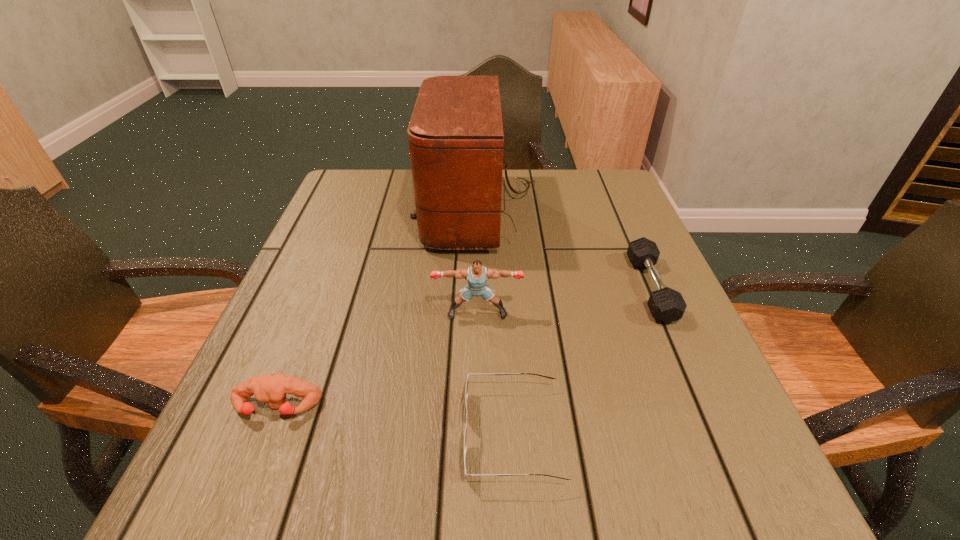
Where is `radio receiver`? radio receiver is located at coordinates (455, 135).

I want to click on the right puncher, so click(477, 275).

I want to click on the fourth shortest object, so click(477, 275).

Where is `the rightmost object`? The height and width of the screenshot is (540, 960). the rightmost object is located at coordinates (665, 304).

What are the coordinates of `the left puncher` in the screenshot? It's located at (270, 388).

Where is `the nearer puncher`? the nearer puncher is located at coordinates (270, 388).

Locate an element on the screen. the shortest object is located at coordinates (467, 383).

Locate an element on the screen. vacant region located on the front panel of the radio receiver is located at coordinates (364, 213).

The height and width of the screenshot is (540, 960). Find the location of `vacant area located 0.180m on the front panel of the radio receiver`. vacant area located 0.180m on the front panel of the radio receiver is located at coordinates (348, 213).

Where is `free spot located 0.200m on the front panel of the radio receiver`? The height and width of the screenshot is (540, 960). free spot located 0.200m on the front panel of the radio receiver is located at coordinates (341, 213).